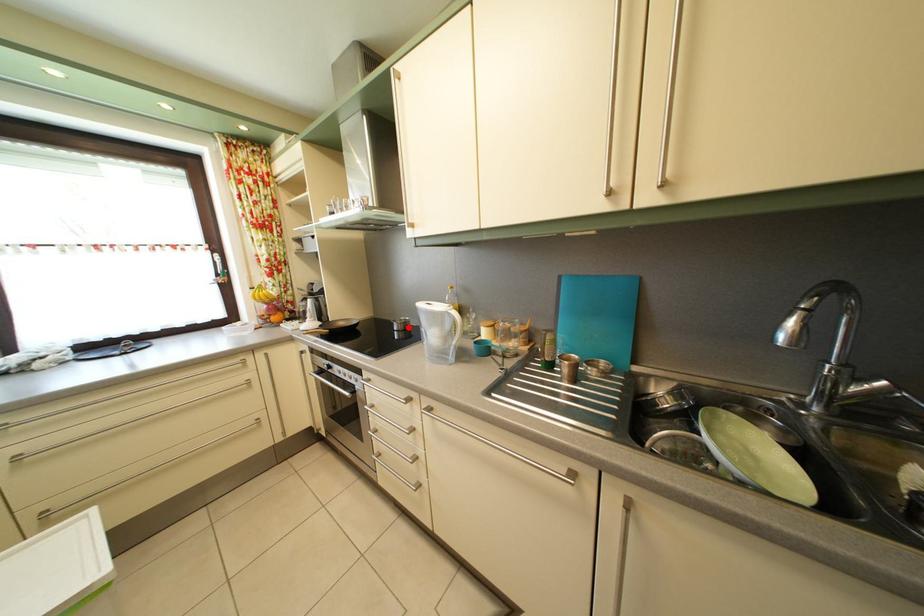
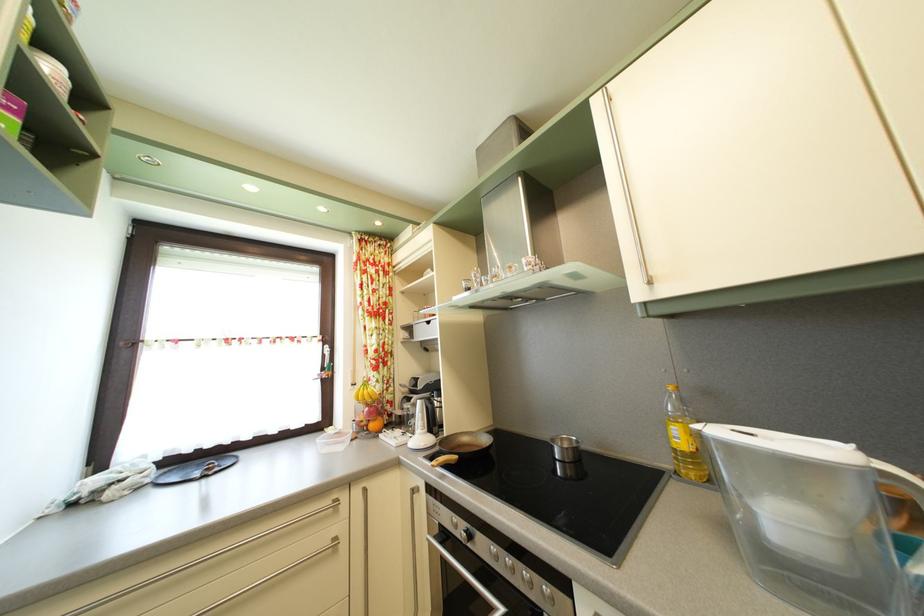
Question: I am providing you with two images of the same scene from different viewpoints. In image1, a red point is highlighted. Considering the same 3D point in image2, which of the following is correct?

Choices:
 (A) It is closer
 (B) It is farther

Answer: (A)